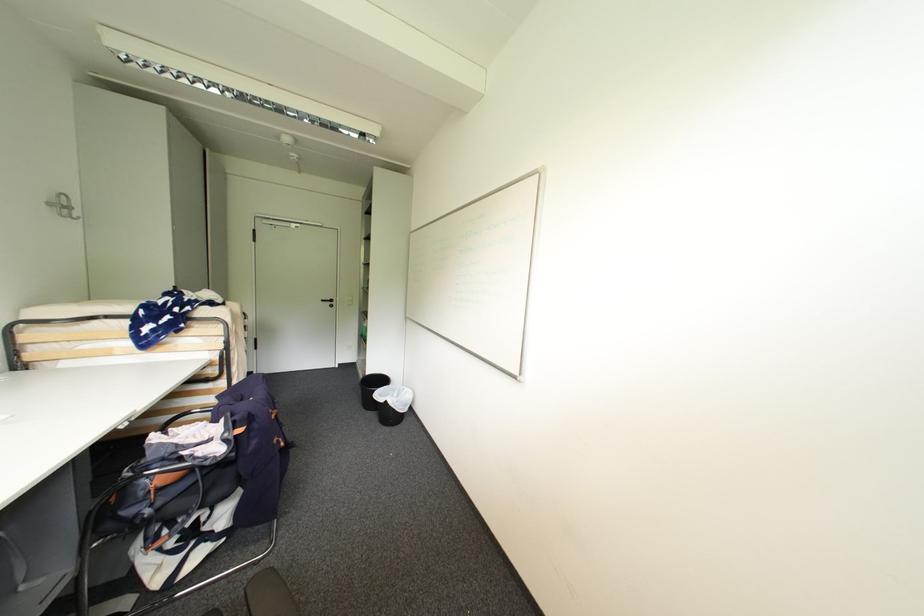
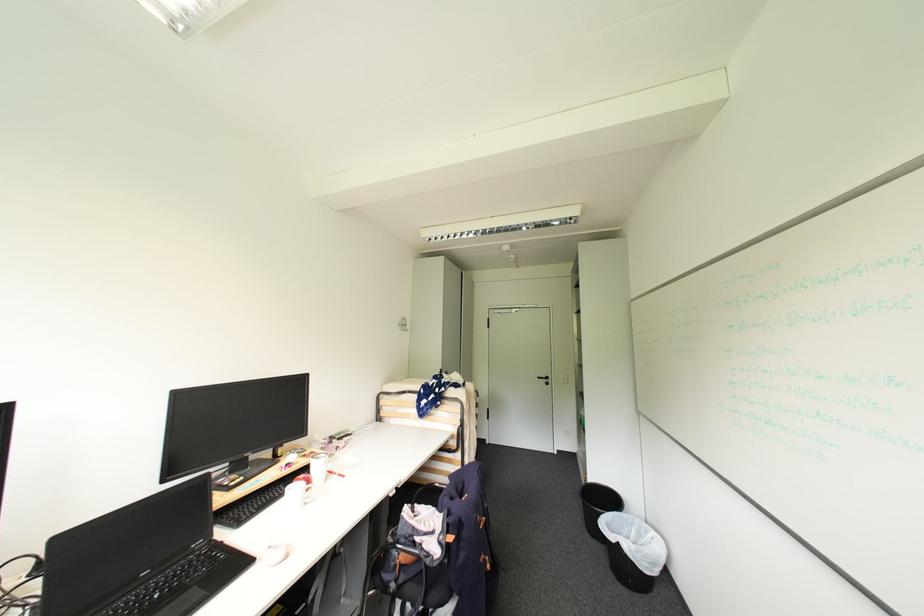
Where in the second image is the point corresponding to point 330,302 from the first image?

(544, 379)